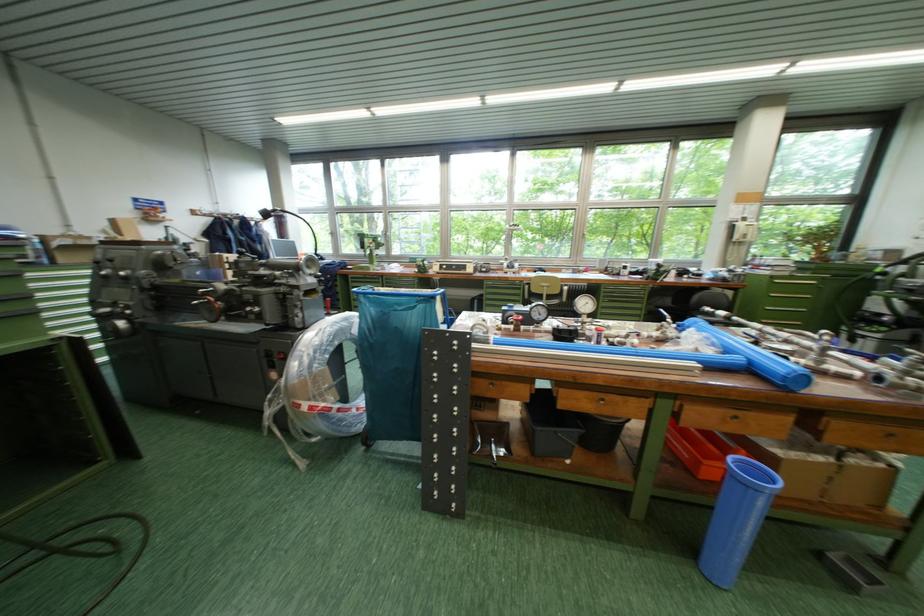
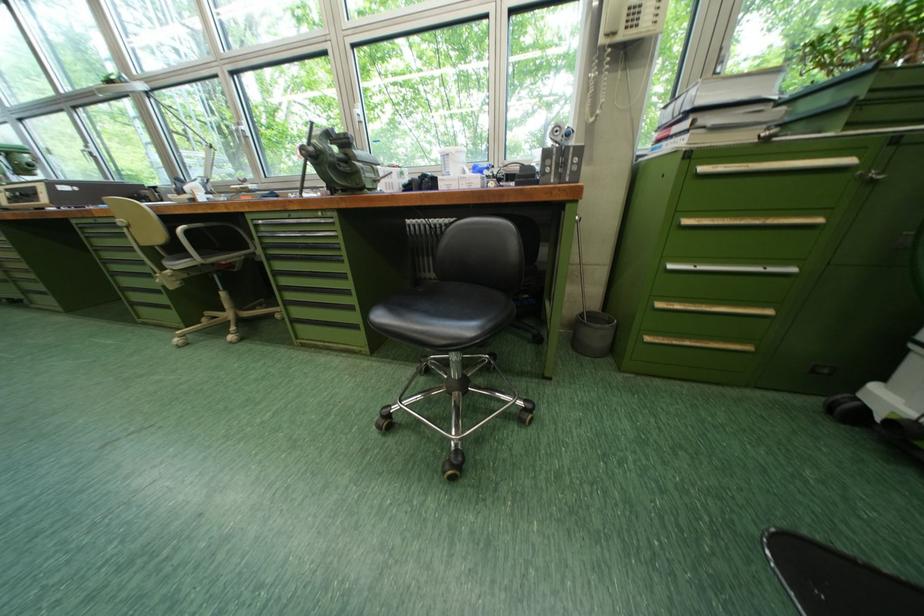
In the second image, find the point that corresponds to (772,270) in the first image.

(686, 132)